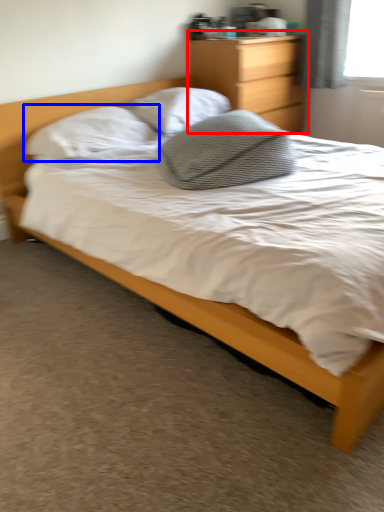
Question: Which point is closer to the camera, nightstand (highlighted by a red box) or pillow (highlighted by a blue box)?

Choices:
 (A) nightstand
 (B) pillow

Answer: (B)